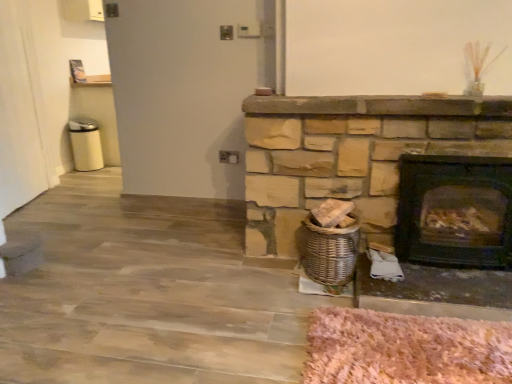
At what (x,y) coordinates should I click in order to perform the action: click on free area below black matte wood burning stove at right (from a real-world perspective). Please return your answer as a coordinate pair (x, y). The image size is (512, 384). Looking at the image, I should click on (456, 267).